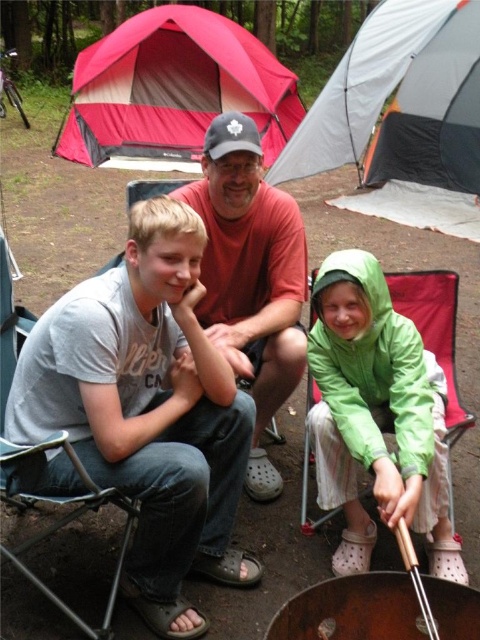
You are standing at the center of the campsite and want to locate the gray fabric tent at upper center. Which direction should you look to find it?

You should look towards the upper center direction to find the gray fabric tent at upper center, as it is located at point coordinates of (402, 116).

You are standing at the point labeled point (141, 579) and want to walk to the point labeled point (336, 294). Which direction should you move in to get closer to your destination?

You should move away from the camera because point (336, 294) is further from the camera than point (141, 579).